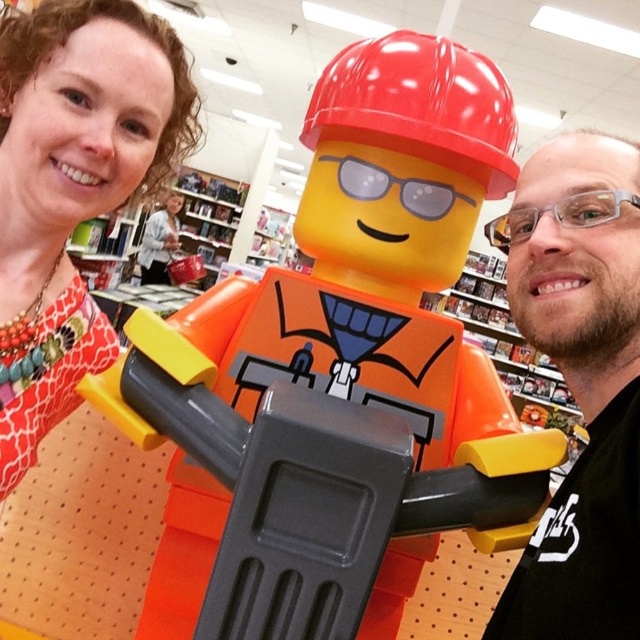
Is the position of matte black shirt at center less distant than that of transparent plastic goggles at center?

Yes, matte black shirt at center is in front of transparent plastic goggles at center.

Who is positioned more to the left, matte black shirt at center or transparent plastic goggles at center?

transparent plastic goggles at center is more to the left.

Find the location of a particular element. The image size is (640, 640). matte black shirt at center is located at coordinates (580, 384).

Which is more to the left, matte orange plastic construction worker at center or transparent plastic goggles at center?

From the viewer's perspective, matte orange plastic construction worker at center appears more on the left side.

Which of these two, matte orange plastic construction worker at center or transparent plastic goggles at center, stands taller?

matte orange plastic construction worker at center is taller.

Who is more forward, (x=340, y=147) or (x=353, y=157)?

Point (x=353, y=157)

You are a GUI agent. You are given a task and a screenshot of the screen. Output one action in this format:
    pyautogui.click(x=<x>, y=<y>)
    Task: Click on the matte orange plastic construction worker at center
    The height and width of the screenshot is (640, 640).
    Given the screenshot: What is the action you would take?
    pyautogui.click(x=337, y=378)

Could you measure the distance between matte orange plastic construction worker at center and matte gray sweater at center?

A distance of 16.94 feet exists between matte orange plastic construction worker at center and matte gray sweater at center.

Is matte orange plastic construction worker at center further to the viewer compared to matte gray sweater at center?

No, matte orange plastic construction worker at center is closer to the viewer.

Does point (209, 305) lie in front of point (170, 212)?

Yes, point (209, 305) is in front of point (170, 212).

This screenshot has width=640, height=640. What are the coordinates of `matte orange plastic construction worker at center` in the screenshot? It's located at (337, 378).